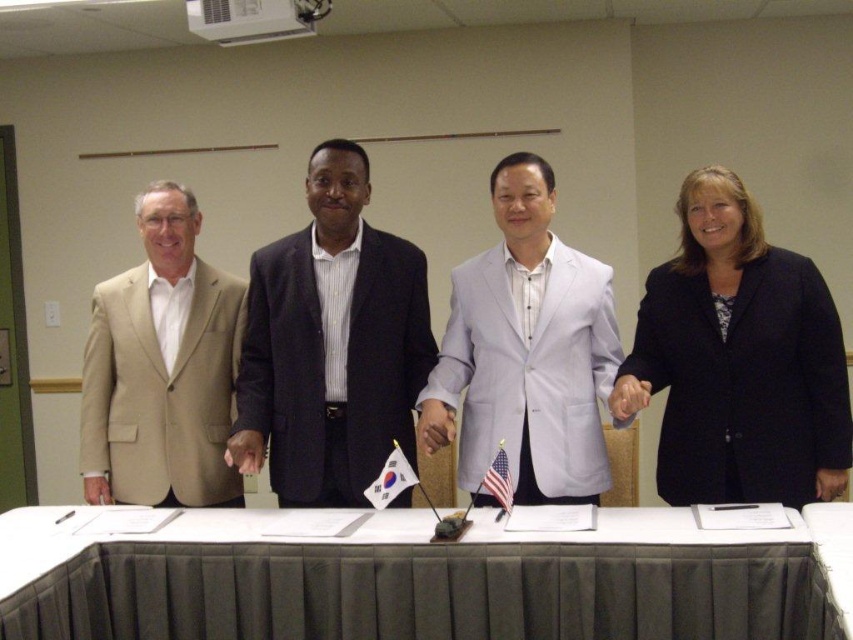
Question: Where is white fabric table at center located in relation to dark blue suit at center in the image?

Choices:
 (A) below
 (B) above

Answer: (A)

Question: Among these points, which one is farthest from the camera?

Choices:
 (A) (361, 406)
 (B) (85, 394)

Answer: (B)

Question: Among these points, which one is nearest to the camera?

Choices:
 (A) (491, 496)
 (B) (397, 493)
 (C) (335, 216)
 (D) (729, 355)

Answer: (D)

Question: Is white fabric table at center behind black matte blazer at right?

Choices:
 (A) yes
 (B) no

Answer: (B)

Question: Which point is farther to the camera?

Choices:
 (A) (4, 588)
 (B) (375, 492)
 (C) (154, 445)

Answer: (C)

Question: Can you confirm if dark blue suit at center is positioned to the right of tan fabric suit at left?

Choices:
 (A) yes
 (B) no

Answer: (A)